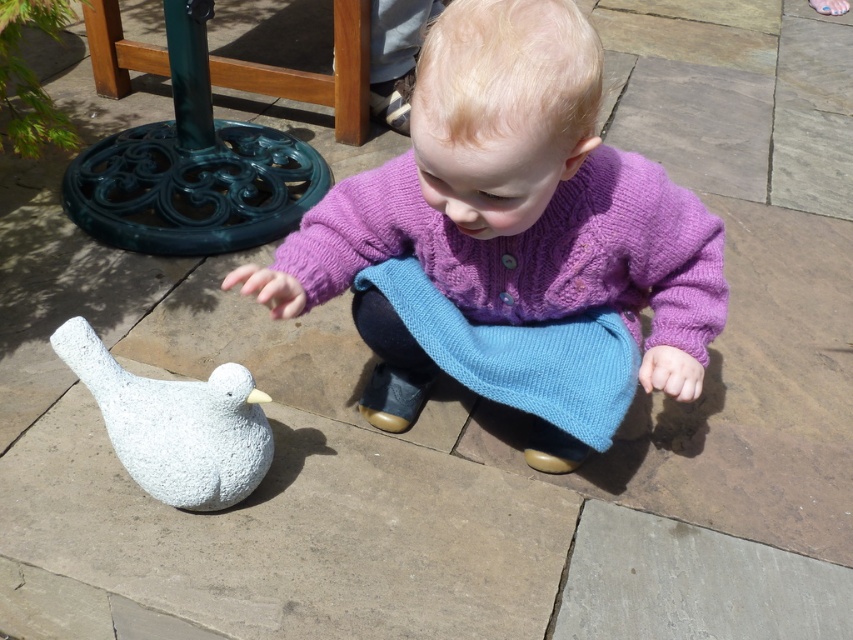
Question: Can you confirm if purple knitted sweater at center is positioned to the right of white textured bird at lower left?

Choices:
 (A) no
 (B) yes

Answer: (B)

Question: Which point appears closest to the camera in this image?

Choices:
 (A) (555, 298)
 (B) (222, 378)

Answer: (B)

Question: Does purple knitted sweater at center appear under white textured bird at lower left?

Choices:
 (A) no
 (B) yes

Answer: (A)

Question: Which point is closer to the camera?

Choices:
 (A) purple knitted sweater at center
 (B) white textured bird at lower left

Answer: (A)

Question: Does purple knitted sweater at center appear on the right side of white textured bird at lower left?

Choices:
 (A) no
 (B) yes

Answer: (B)